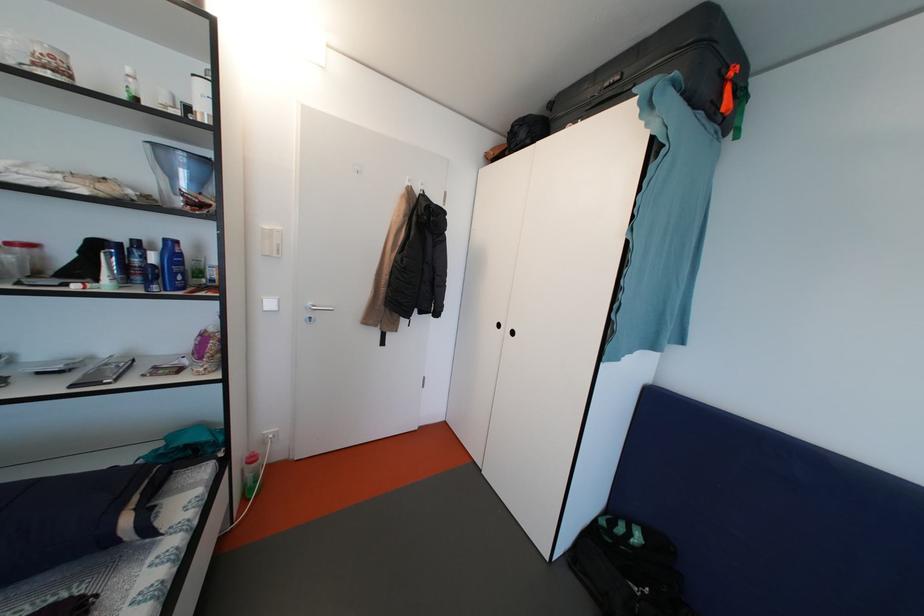
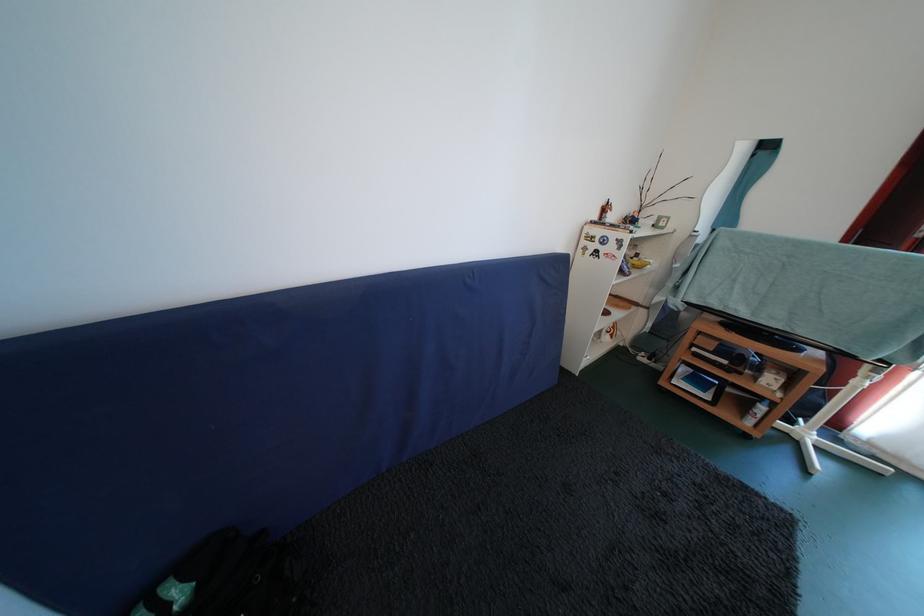
Based on the photo, first-person continuous shooting, in which direction is the camera rotating?

The camera rotated toward right-down.